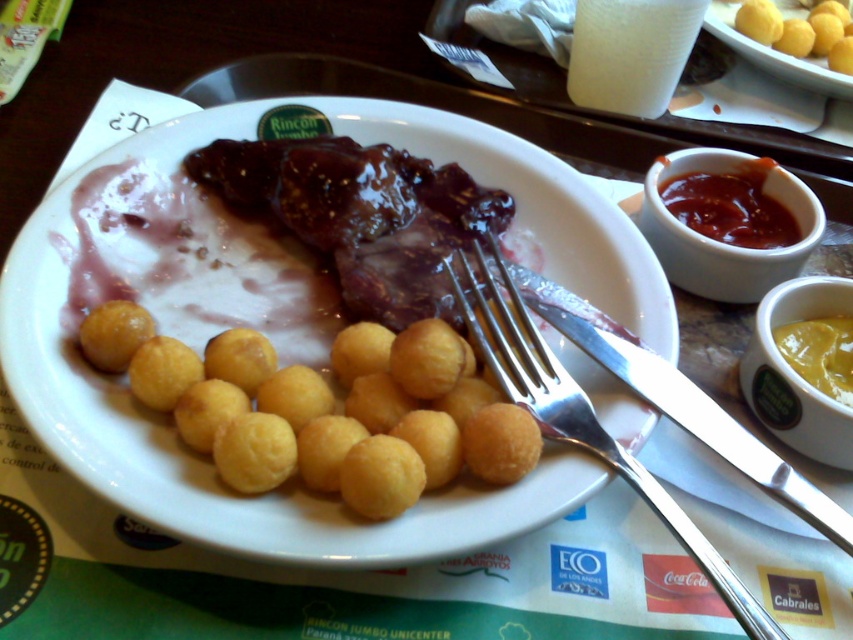
You are a diner who wants to dip the yellow matte balls at upper right into the condiments. Which condiment ramekin is closer to the silver metallic fork at upper center?

The silver metallic fork at upper center is positioned on the left side of yellow matte balls at upper right, so the condiment ramekin closer to the silver metallic fork at upper center would depend on their arrangement. However, based on the given information, the silver metallic fork at upper center is to the left of the yellow matte balls at upper right, implying the condiment ramekins might be positioned further to the left or right. Without specific details about the condiment ramekins, it is unclear.

You are a food critic observing the plated meal. You need to describe the spatial arrangement of the golden fried balls at center and the yellow matte balls at upper right. Which one is positioned to the left?

The golden fried balls at center is positioned to the left of the yellow matte balls at upper right.